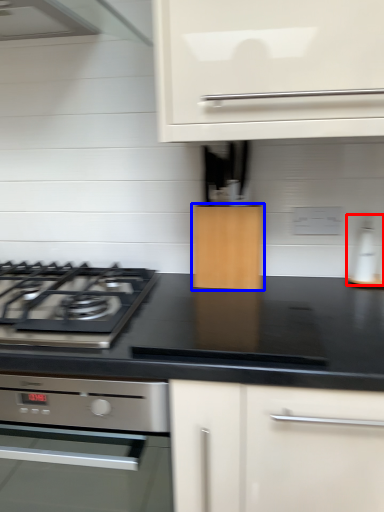
Question: Which point is closer to the camera, kitchen appliance (highlighted by a red box) or cabinetry (highlighted by a blue box)?

Choices:
 (A) kitchen appliance
 (B) cabinetry

Answer: (B)